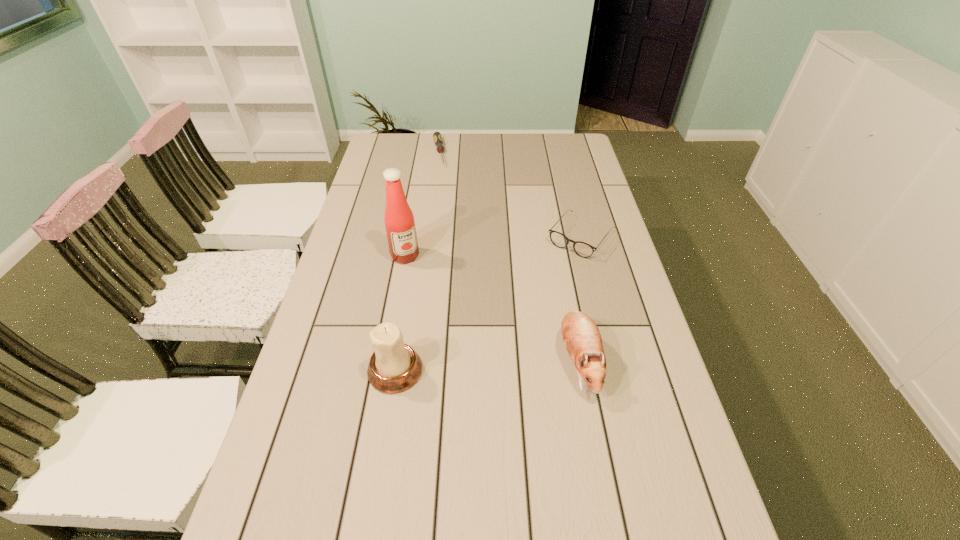
The width and height of the screenshot is (960, 540). Identify the location of free space between the tallest object and the second shortest object. click(493, 246).

Identify the location of vacant space that's between the candle holder and the fourth tallest object. (489, 303).

The image size is (960, 540). Find the location of `vacant region between the shortest object and the condiment`. vacant region between the shortest object and the condiment is located at coordinates (421, 204).

The width and height of the screenshot is (960, 540). What are the coordinates of `free area in between the fourth tallest object and the tallest object` in the screenshot? It's located at (493, 246).

Locate an element on the screen. This screenshot has height=540, width=960. empty space that is in between the fourth tallest object and the farthest object is located at coordinates (510, 195).

Choose which object is the nearest neighbor to the second tallest object. Please provide its 2D coordinates. Your answer should be formatted as a tuple, i.e. [(x, y)], where the tuple contains the x and y coordinates of a point satisfying the conditions above.

[(399, 221)]

The height and width of the screenshot is (540, 960). I want to click on the second closest object relative to the farthest object, so click(582, 249).

I want to click on vacant point that satisfies the following two spatial constraints: 1. on the back side of the candle holder; 2. on the right side of the shortest object, so click(430, 152).

Locate an element on the screen. vacant space that satisfies the following two spatial constraints: 1. on the back side of the second shortest object; 2. on the right side of the condiment is located at coordinates (408, 237).

Locate an element on the screen. This screenshot has height=540, width=960. free space that satisfies the following two spatial constraints: 1. on the back side of the spectacles; 2. on the right side of the condiment is located at coordinates (408, 237).